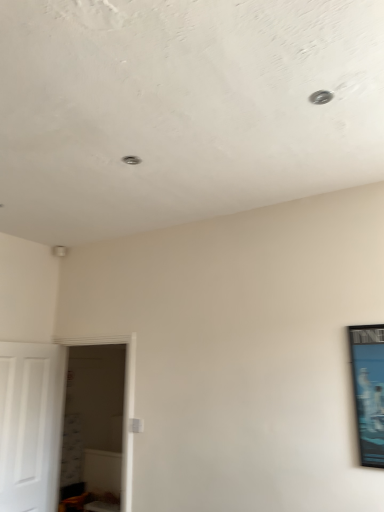
Question: Considering the positions of metallic blue poster at right and white matte door at left in the image, is metallic blue poster at right wider or thinner than white matte door at left?

Choices:
 (A) thin
 (B) wide

Answer: (A)

Question: Choose the correct answer: Is metallic blue poster at right inside white matte door at left or outside it?

Choices:
 (A) inside
 (B) outside

Answer: (B)

Question: Which of these objects is positioned closest to the white glossy door at left?

Choices:
 (A) white matte door at left
 (B) metallic blue poster at right

Answer: (A)

Question: Considering the real-world distances, which object is closest to the white glossy door at left?

Choices:
 (A) white matte door at left
 (B) metallic blue poster at right

Answer: (A)